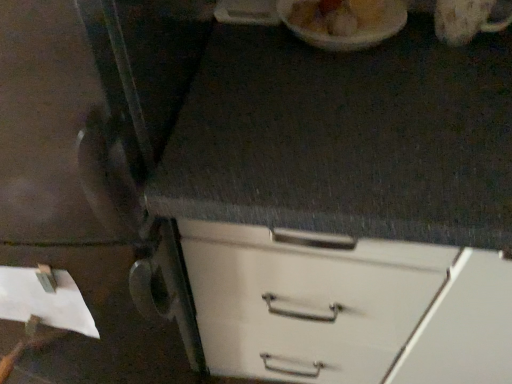
Describe the element at coordinates (44, 299) in the screenshot. I see `white paper at lower left` at that location.

Locate an element on the screen. white paper at lower left is located at coordinates (44, 299).

The width and height of the screenshot is (512, 384). What are the coordinates of `white paper at lower left` in the screenshot? It's located at point(44,299).